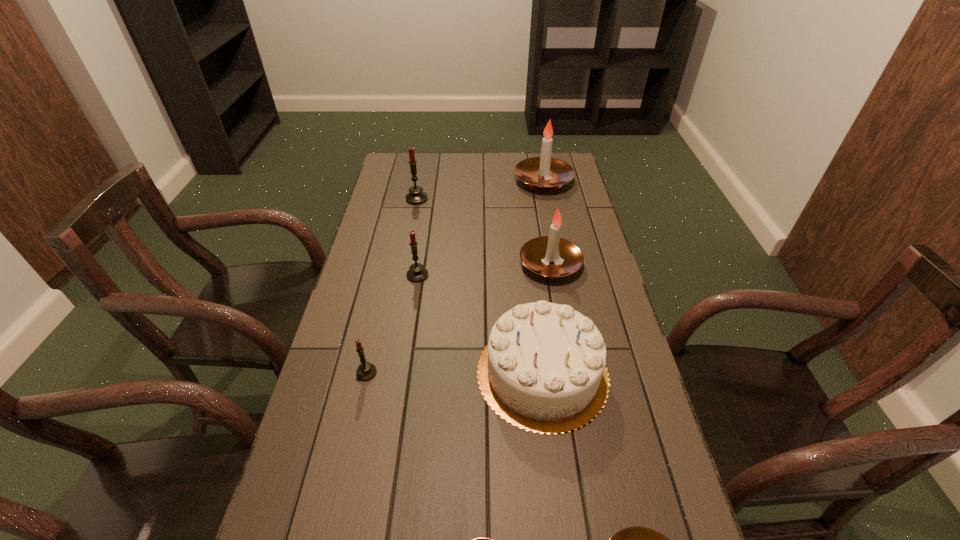
Locate an element on the screen. vacant space at the far right corner of the desktop is located at coordinates (574, 180).

Locate an element on the screen. The width and height of the screenshot is (960, 540). free area in between the second farthest red candle and the farthest red candle is located at coordinates (418, 237).

Locate an element on the screen. The width and height of the screenshot is (960, 540). empty space that is in between the biggest red candle and the birthday cake is located at coordinates (480, 286).

Locate an element on the screen. free space between the farthest white candle and the birthday cake is located at coordinates (542, 277).

This screenshot has width=960, height=540. I want to click on vacant space in between the birthday cake and the smallest red candle, so click(x=454, y=373).

Find the location of `object that stands as the second closest to the birthday cake`. object that stands as the second closest to the birthday cake is located at coordinates (636, 539).

The image size is (960, 540). I want to click on object that is the third closest to the third smallest white candle, so click(544, 173).

Identify which candle is the third nearest to the second biggest white candle. Please provide its 2D coordinates. Your answer should be formatted as a tuple, i.e. [(x, y)], where the tuple contains the x and y coordinates of a point satisfying the conditions above.

[(416, 196)]

Where is `candle that is the second closest to the third nearest candle`? This screenshot has height=540, width=960. candle that is the second closest to the third nearest candle is located at coordinates (477, 539).

This screenshot has width=960, height=540. What are the coordinates of `white candle that stands as the second closest to the third smallest white candle` in the screenshot? It's located at [636, 539].